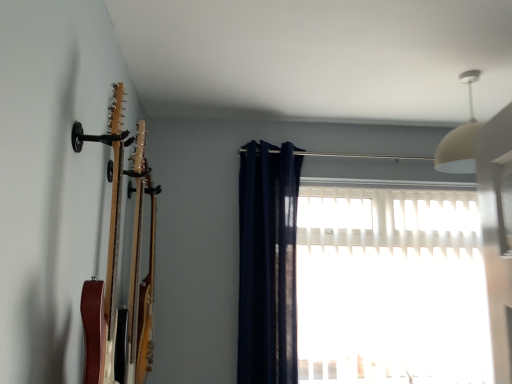
Question: Can you confirm if navy blue fabric curtain at center is shorter than wooden acoustic guitar at left?

Choices:
 (A) no
 (B) yes

Answer: (A)

Question: Does navy blue fabric curtain at center touch wooden acoustic guitar at left?

Choices:
 (A) no
 (B) yes

Answer: (A)

Question: From the image's perspective, is navy blue fabric curtain at center under wooden acoustic guitar at left?

Choices:
 (A) yes
 (B) no

Answer: (A)

Question: Is wooden acoustic guitar at left at the back of navy blue fabric curtain at center?

Choices:
 (A) yes
 (B) no

Answer: (B)

Question: Does navy blue fabric curtain at center appear on the right side of wooden acoustic guitar at left?

Choices:
 (A) no
 (B) yes

Answer: (B)

Question: From the image's perspective, is navy blue fabric curtain at center located above or below white translucent blinds at center?

Choices:
 (A) below
 (B) above

Answer: (B)

Question: Is point (271, 301) closer or farther from the camera than point (396, 365)?

Choices:
 (A) farther
 (B) closer

Answer: (B)

Question: Is navy blue fabric curtain at center bigger or smaller than white translucent blinds at center?

Choices:
 (A) small
 (B) big

Answer: (A)

Question: Relative to white translucent blinds at center, is navy blue fabric curtain at center in front or behind?

Choices:
 (A) behind
 (B) front

Answer: (B)

Question: Is wooden acoustic guitar at left in front of or behind white translucent blinds at center in the image?

Choices:
 (A) behind
 (B) front

Answer: (B)

Question: Considering the positions of point (140, 178) and point (486, 355), is point (140, 178) closer or farther from the camera than point (486, 355)?

Choices:
 (A) farther
 (B) closer

Answer: (B)

Question: Looking at their shapes, would you say wooden acoustic guitar at left is wider or thinner than white translucent blinds at center?

Choices:
 (A) thin
 (B) wide

Answer: (A)

Question: Do you think wooden acoustic guitar at left is within white translucent blinds at center, or outside of it?

Choices:
 (A) inside
 (B) outside

Answer: (B)

Question: Considering the positions of point (284, 360) and point (293, 218), is point (284, 360) closer or farther from the camera than point (293, 218)?

Choices:
 (A) closer
 (B) farther

Answer: (A)

Question: From the image's perspective, is white translucent blinds at center located above or below navy blue fabric curtain at center?

Choices:
 (A) below
 (B) above

Answer: (A)